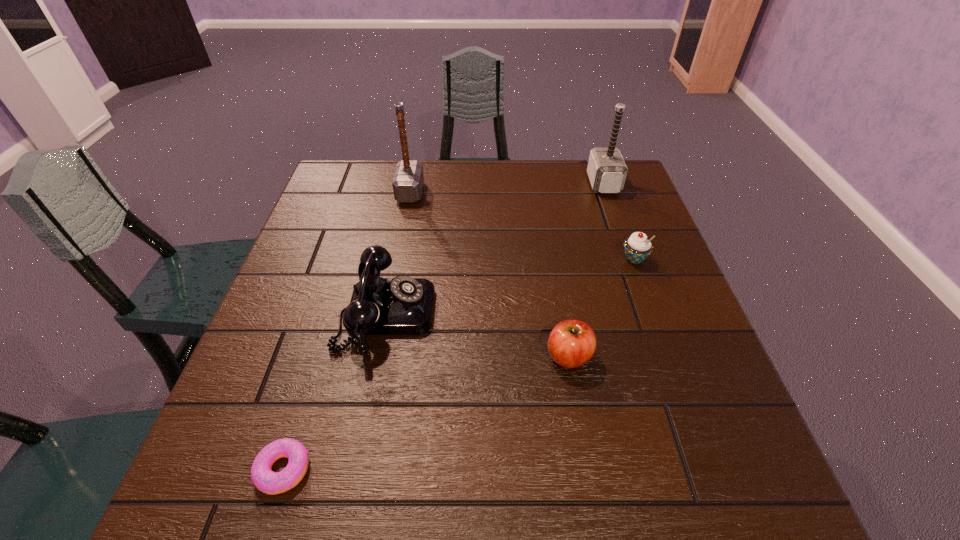
In order to click on free space that satisfies the following two spatial constraints: 1. on the striking surface of the cupcake; 2. on the left side of the left hammer in this screenshot , I will do `click(397, 259)`.

Identify the location of vacant space that satisfies the following two spatial constraints: 1. on the back side of the shortest object; 2. on the right side of the cupcake. (348, 259).

I want to click on vacant space that satisfies the following two spatial constraints: 1. on the striking surface of the left hammer; 2. on the front side of the doughnut, so click(x=356, y=469).

I want to click on vacant space that satisfies the following two spatial constraints: 1. on the back side of the apple; 2. on the striking surface of the left hammer, so click(540, 192).

You are a GUI agent. You are given a task and a screenshot of the screen. Output one action in this format:
    pyautogui.click(x=<x>, y=<y>)
    Task: Click on the vacant space that satisfies the following two spatial constraints: 1. on the striking surface of the third object from right to left; 2. on the right side of the left hammer
    The image size is (960, 540).
    Given the screenshot: What is the action you would take?
    pyautogui.click(x=378, y=356)

You are a GUI agent. You are given a task and a screenshot of the screen. Output one action in this format:
    pyautogui.click(x=<x>, y=<y>)
    Task: Click on the vacant space that satisfies the following two spatial constraints: 1. on the striking surface of the left hammer; 2. on the back side of the third farthest object
    
    Given the screenshot: What is the action you would take?
    pyautogui.click(x=397, y=259)

Locate an element on the screen. free space that satisfies the following two spatial constraints: 1. on the back side of the shortest object; 2. on the left side of the fourth object from left to right is located at coordinates (319, 356).

In order to click on free point that satisfies the following two spatial constraints: 1. on the dial of the third object from right to left; 2. on the right side of the fourth shortest object in this screenshot , I will do `click(377, 356)`.

Locate an element on the screen. This screenshot has width=960, height=540. free region that satisfies the following two spatial constraints: 1. on the striking surface of the cupcake; 2. on the right side of the left hammer is located at coordinates (397, 259).

What are the coordinates of `vacant region that satisfies the following two spatial constraints: 1. on the striking surface of the apple; 2. on the left side of the left hammer` in the screenshot? It's located at (378, 356).